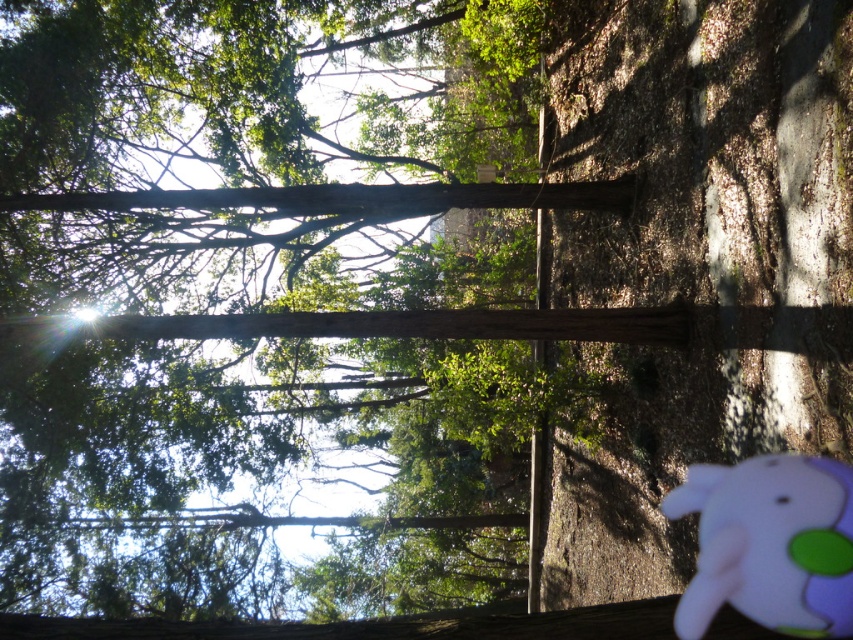
Does brown wood tree at center appear over pink fabric baby elephant at lower right?

Indeed, brown wood tree at center is positioned over pink fabric baby elephant at lower right.

Is point (526, 99) positioned behind point (741, 560)?

Yes, point (526, 99) is behind point (741, 560).

Locate an element on the screen. Image resolution: width=853 pixels, height=640 pixels. brown wood tree at center is located at coordinates (234, 456).